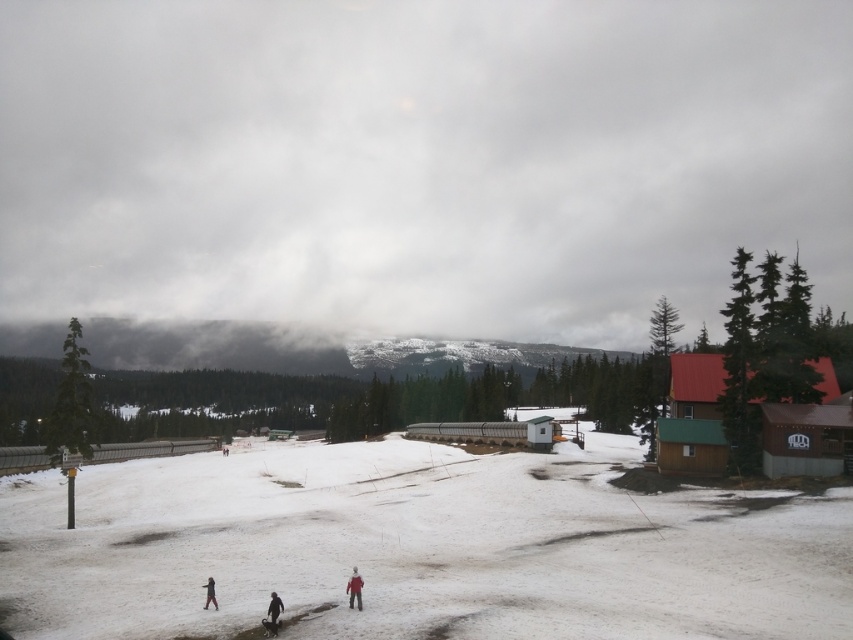
Locate an element on the screen. The image size is (853, 640). white snow at center is located at coordinates (418, 548).

Is point (650, 536) positioned behind point (268, 608)?

Yes, it is behind point (268, 608).

Identify the location of white snow at center. (418, 548).

Does dark gray fabric jacket at lower center have a greater height compared to red woolen jacket at lower center?

No.

Does dark gray fabric jacket at lower center lie in front of red woolen jacket at lower center?

Yes, it is.

Is point (268, 618) less distant than point (360, 595)?

Yes, point (268, 618) is closer to viewer.

Identify the location of dark gray fabric jacket at lower center. Image resolution: width=853 pixels, height=640 pixels. (273, 612).

Which of these two, red woolen jacket at lower center or dark red jacket at lower center, stands taller?

red woolen jacket at lower center

Is point (352, 595) less distant than point (204, 605)?

Yes, it is in front of point (204, 605).

Which is behind, point (351, 586) or point (207, 602)?

The point (207, 602) is behind.

Find the location of `red woolen jacket at lower center`. red woolen jacket at lower center is located at coordinates (354, 589).